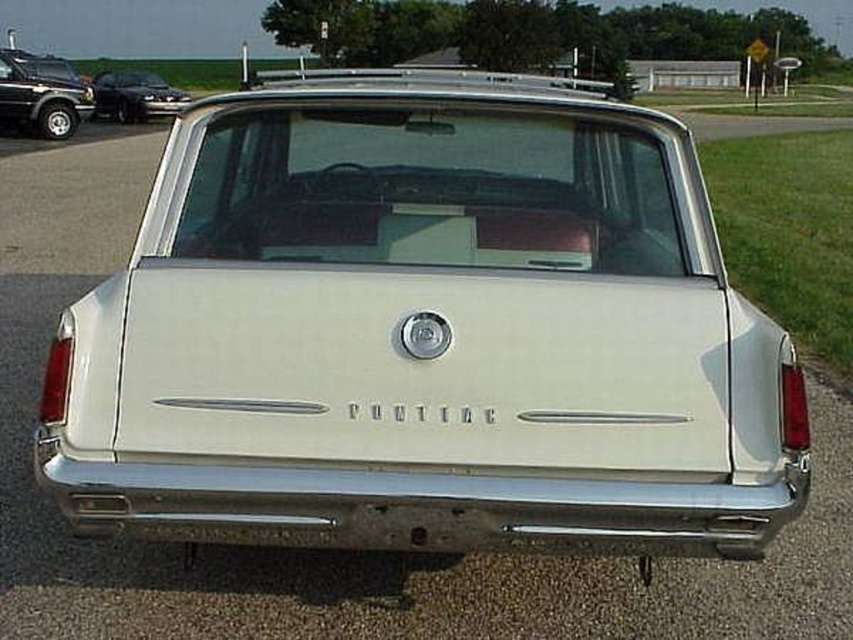
You are a parking attendant who needs to guide a car into a parking spot that is 4.5 meters wide. You see the matte black suv at upper left and the shiny black sedan at left in the parking lot. Can the car fit between them without touching either vehicle?

The distance between the matte black suv at upper left and the shiny black sedan at left is 4.10 meters. Since the parking spot requires 4.5 meters, the car cannot fit between them as the available space is smaller than needed.

You are standing in front of a vintage Pontiac car and notice a matte black suv at upper left in the background. Based on their positions, which object is closer to the top edge of the image?

The matte black suv at upper left is closer to the top edge of the image because its position is at point (39, 97), which has a lower y coordinate value, indicating it is closer to the top.

You are standing in front of a vintage car display. You see a white matte station wagon at center. Where is the white matte station wagon positioned relative to the center of the display area?

The white matte station wagon at center is located exactly at the center of the display area, at coordinates point (425, 332).